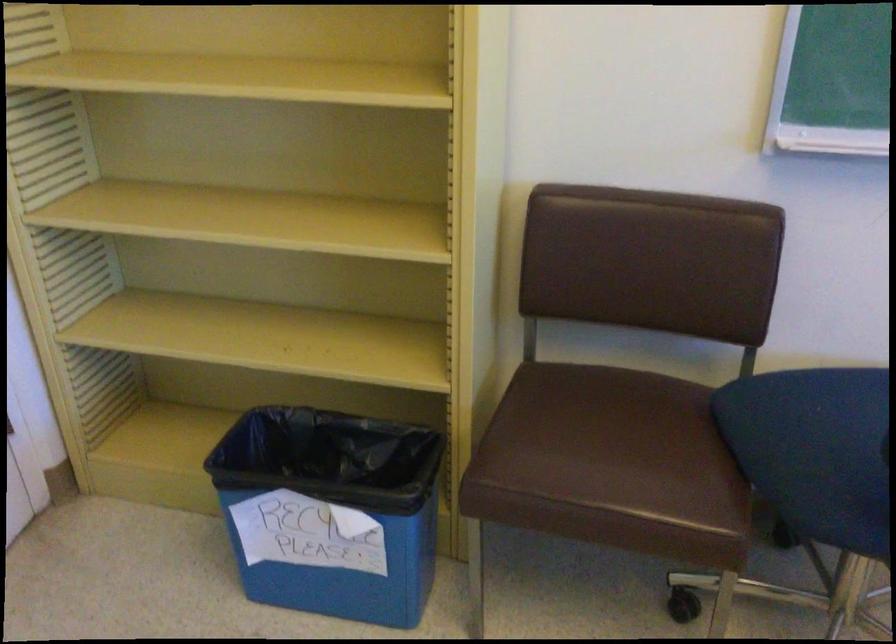
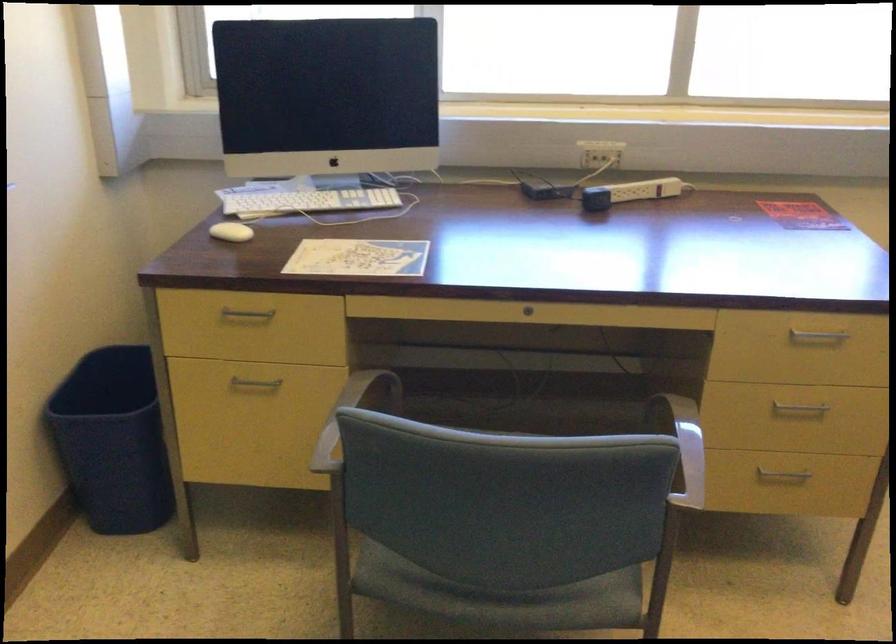
Based on the continuous images, in which direction is the camera rotating?

The camera rotated toward right-down.